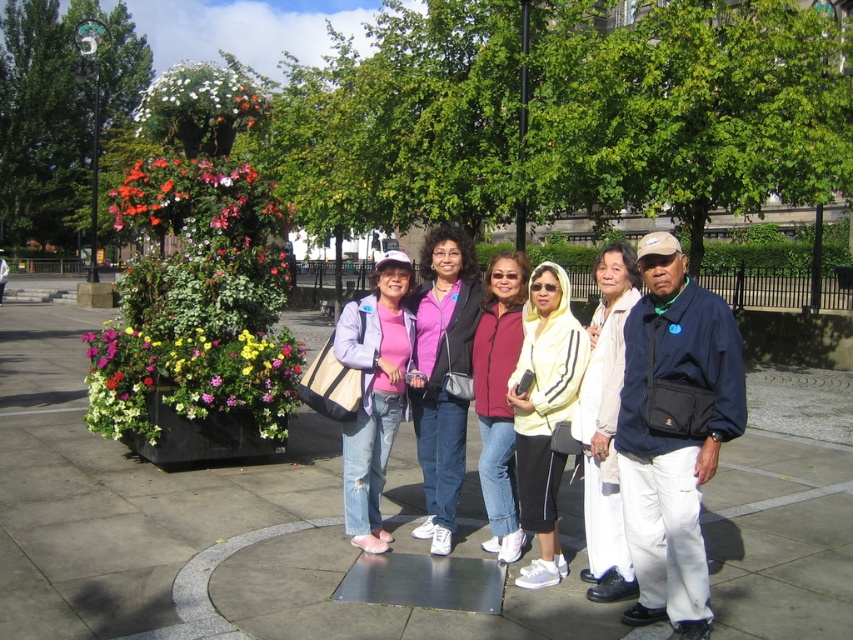
Who is more distant from viewer, (564, 300) or (589, 438)?

The point (564, 300) is behind.

Which is more to the left, yellow/white striped hoodie at center or white cotton pants at center?

yellow/white striped hoodie at center is more to the left.

Describe the element at coordinates (544, 412) in the screenshot. I see `yellow/white striped hoodie at center` at that location.

Locate an element on the screen. yellow/white striped hoodie at center is located at coordinates (544, 412).

Between point (520, 465) and point (364, 451), which one is positioned behind?

The point (364, 451) is behind.

Which of these two, yellow/white striped hoodie at center or matte pink sweater at center, stands shorter?

With less height is yellow/white striped hoodie at center.

Who is more distant from viewer, (573, 360) or (364, 308)?

Positioned behind is point (364, 308).

The width and height of the screenshot is (853, 640). Identify the location of yellow/white striped hoodie at center. (544, 412).

Does matte purple jacket at center have a lesser height compared to yellow/white striped hoodie at center?

No.

In the scene shown: Who is positioned more to the left, matte purple jacket at center or yellow/white striped hoodie at center?

From the viewer's perspective, matte purple jacket at center appears more on the left side.

Does point (454, 257) come farther from viewer compared to point (532, 353)?

Yes.

Image resolution: width=853 pixels, height=640 pixels. Identify the location of matte purple jacket at center. (442, 372).